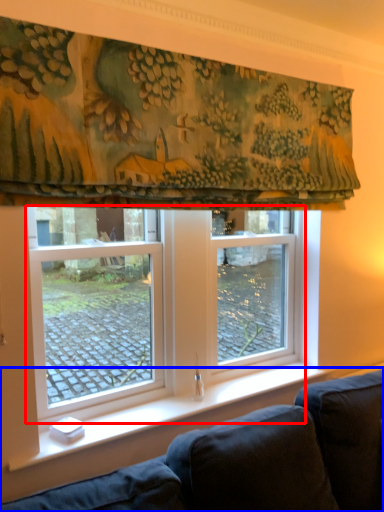
Question: Among these objects, which one is nearest to the camera, window (highlighted by a red box) or studio couch (highlighted by a blue box)?

Choices:
 (A) window
 (B) studio couch

Answer: (B)